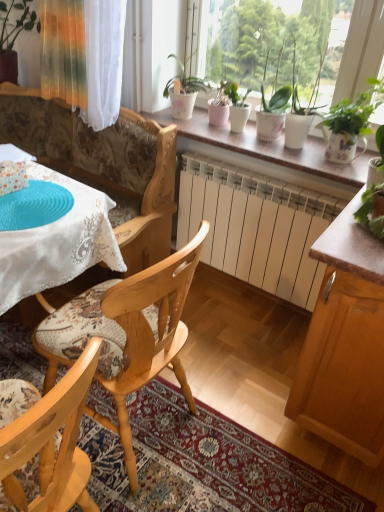
Where is `vacant area situated below wooden placemat at lower center (from a real-world perspective)`? This screenshot has height=512, width=384. vacant area situated below wooden placemat at lower center (from a real-world perspective) is located at coordinates (225, 479).